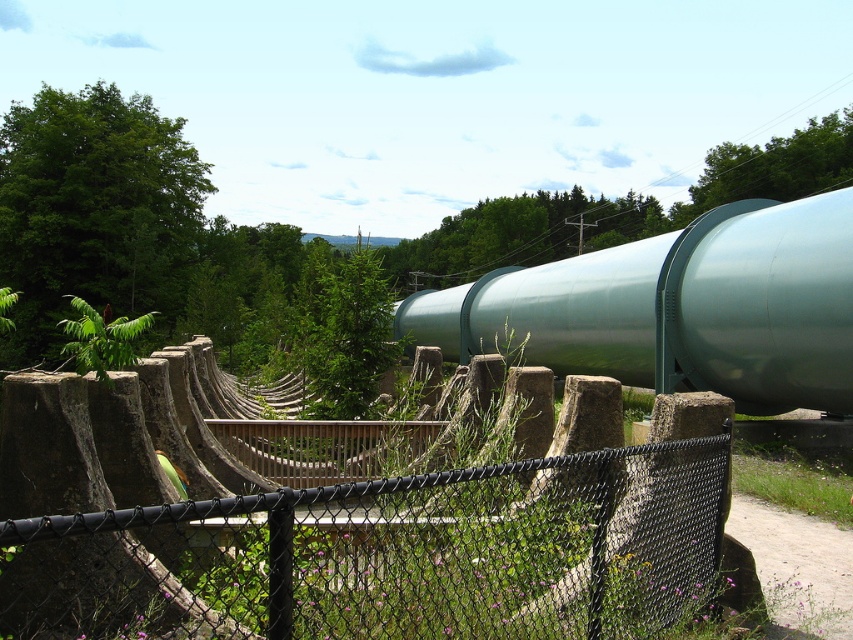
Question: Does green metallic pipe at center appear over green leafy tree at upper left?

Choices:
 (A) no
 (B) yes

Answer: (A)

Question: Considering the real-world distances, which object is farthest from the green leafy tree at upper right?

Choices:
 (A) green leafy tree at center
 (B) green leafy tree at upper left

Answer: (B)

Question: Can you confirm if black chain-link fence at center is smaller than green leafy tree at upper left?

Choices:
 (A) no
 (B) yes

Answer: (B)

Question: Among these points, which one is farthest from the camera?

Choices:
 (A) (744, 316)
 (B) (575, 211)
 (C) (352, 596)
 (D) (839, 140)

Answer: (B)

Question: Which of the following is the closest to the observer?

Choices:
 (A) (541, 204)
 (B) (631, 552)

Answer: (B)

Question: Is green leafy tree at upper left bigger than green leafy tree at center?

Choices:
 (A) no
 (B) yes

Answer: (A)